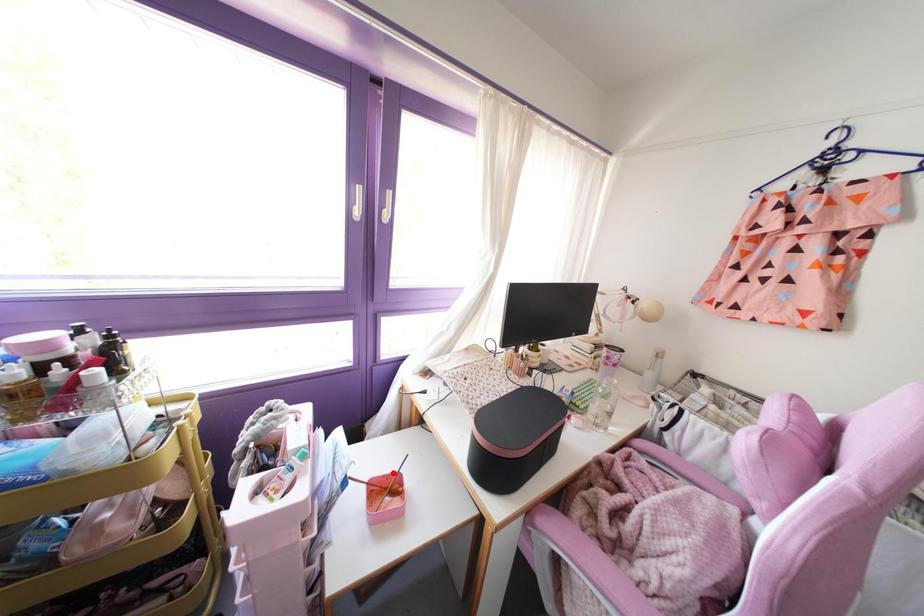
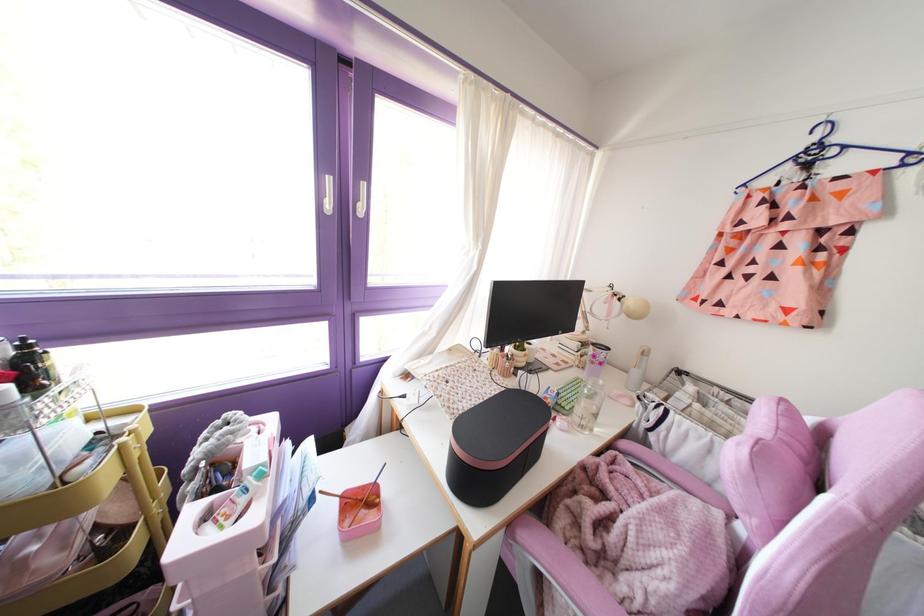
In the second image, find the point that corresponds to the highlighted location in the first image.

(370, 484)